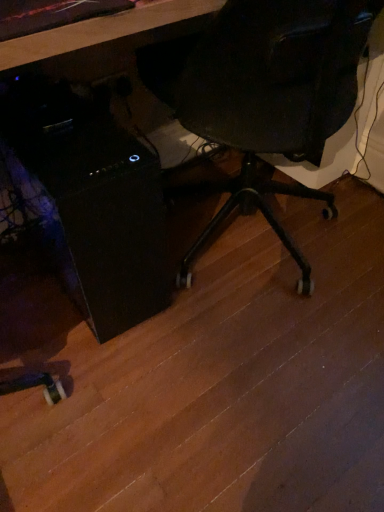
Identify the location of vacant region above black matte computer tower at lower left (from a real-world perspective). Image resolution: width=384 pixels, height=512 pixels. (69, 137).